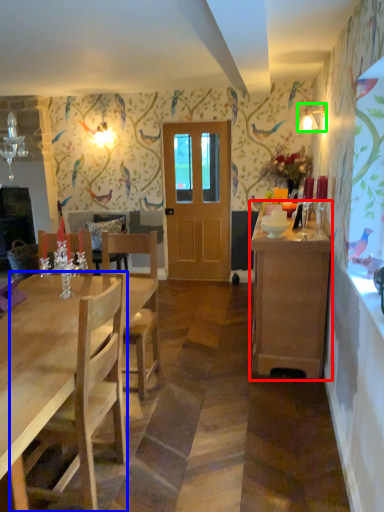
Question: Considering the real-world distances, which object is closest to cabinetry (highlighted by a red box)? chair (highlighted by a blue box) or lamp (highlighted by a green box).

Choices:
 (A) chair
 (B) lamp

Answer: (A)